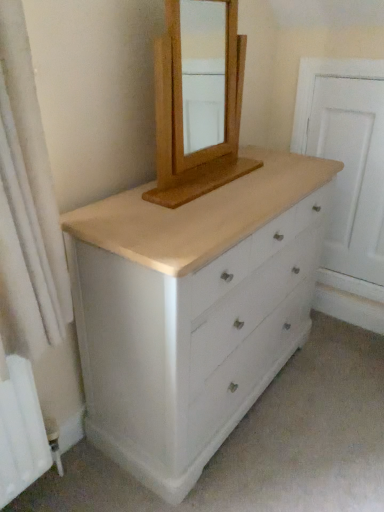
Where is `white wood screen door at right`? white wood screen door at right is located at coordinates (352, 170).

This screenshot has height=512, width=384. In order to click on natural wood mirror at upper center in this screenshot , I will do `click(198, 101)`.

Consider the image. Could you measure the distance between white painted wood chest of drawers at center and white wood screen door at right?

white painted wood chest of drawers at center and white wood screen door at right are 83.64 centimeters apart from each other.

Between white painted wood chest of drawers at center and white wood screen door at right, which one has more height?

white wood screen door at right.

How different are the orientations of white painted wood chest of drawers at center and white wood screen door at right in degrees?

The angle between the facing direction of white painted wood chest of drawers at center and the facing direction of white wood screen door at right is 90 degrees.

Which is less distant, (167,347) or (383,147)?

Point (167,347)

Which is behind, natural wood mirror at upper center or white fabric shower curtain at left?

natural wood mirror at upper center is further away from the camera.

Considering the positions of objects natural wood mirror at upper center and white fabric shower curtain at left in the image provided, who is more to the right, natural wood mirror at upper center or white fabric shower curtain at left?

From the viewer's perspective, natural wood mirror at upper center appears more on the right side.

From a real-world perspective, is natural wood mirror at upper center physically above white fabric shower curtain at left?

Yes, from a real-world perspective, natural wood mirror at upper center is over white fabric shower curtain at left

Does white fabric shower curtain at left have a larger size compared to natural wood mirror at upper center?

Correct, white fabric shower curtain at left is larger in size than natural wood mirror at upper center.

Is white fabric shower curtain at left not close to natural wood mirror at upper center?

That's right, there is a large distance between white fabric shower curtain at left and natural wood mirror at upper center.

Is white fabric shower curtain at left spatially inside natural wood mirror at upper center, or outside of it?

white fabric shower curtain at left lies outside natural wood mirror at upper center.

Is white fabric shower curtain at left looking in the opposite direction of white painted wood chest of drawers at center?

white fabric shower curtain at left is not turned away from white painted wood chest of drawers at center.

From a real-world perspective, is white fabric shower curtain at left over white painted wood chest of drawers at center?

Yes.

Can you confirm if white fabric shower curtain at left is shorter than white painted wood chest of drawers at center?

Indeed, white fabric shower curtain at left has a lesser height compared to white painted wood chest of drawers at center.

Considering the relative sizes of white fabric shower curtain at left and white painted wood chest of drawers at center in the image provided, is white fabric shower curtain at left bigger than white painted wood chest of drawers at center?

No.

The height and width of the screenshot is (512, 384). Find the location of `the chest of drawers lying below the white fabric shower curtain at left (from the image's perspective)`. the chest of drawers lying below the white fabric shower curtain at left (from the image's perspective) is located at coordinates (192, 311).

From the image's perspective, would you say white painted wood chest of drawers at center is shown under white fabric shower curtain at left?

Yes.

From a real-world perspective, is white painted wood chest of drawers at center physically located above or below white fabric shower curtain at left?

white painted wood chest of drawers at center is below white fabric shower curtain at left.

How distant is white painted wood chest of drawers at center from white fabric shower curtain at left?

A distance of 50.60 centimeters exists between white painted wood chest of drawers at center and white fabric shower curtain at left.

Considering the positions of objects white wood screen door at right and white painted wood chest of drawers at center in the image provided, who is behind, white wood screen door at right or white painted wood chest of drawers at center?

white wood screen door at right is further away from the camera.

Consider the image. Does white wood screen door at right touch white painted wood chest of drawers at center?

No, white wood screen door at right is not touching white painted wood chest of drawers at center.

Is white wood screen door at right inside the boundaries of white painted wood chest of drawers at center, or outside?

white wood screen door at right is not enclosed by white painted wood chest of drawers at center.

Between white painted wood chest of drawers at center and natural wood mirror at upper center, which one has smaller size?

Smaller between the two is natural wood mirror at upper center.

From a real-world perspective, is white painted wood chest of drawers at center over natural wood mirror at upper center?

No, from a real-world perspective, white painted wood chest of drawers at center is not on top of natural wood mirror at upper center.

Based on the photo, is white painted wood chest of drawers at center surrounding natural wood mirror at upper center?

No, white painted wood chest of drawers at center does not contain natural wood mirror at upper center.

Is point (253, 377) closer or farther from the camera than point (158, 204)?

Point (253, 377).

Locate an element on the screen. Image resolution: width=384 pixels, height=512 pixels. screen door on the right side of white painted wood chest of drawers at center is located at coordinates (352, 170).

Locate an element on the screen. Image resolution: width=384 pixels, height=512 pixels. shower curtain lying below the natural wood mirror at upper center (from the image's perspective) is located at coordinates (28, 223).

From the image, which object appears to be nearer to white fabric shower curtain at left, white painted wood chest of drawers at center or white wood screen door at right?

white painted wood chest of drawers at center lies closer to white fabric shower curtain at left than the other object.

From the image, which object appears to be nearer to white wood screen door at right, natural wood mirror at upper center or white fabric shower curtain at left?

natural wood mirror at upper center.

Which object lies further to the anchor point natural wood mirror at upper center, white painted wood chest of drawers at center or white wood screen door at right?

white painted wood chest of drawers at center lies further to natural wood mirror at upper center than the other object.

Looking at the image, which one is located further to white wood screen door at right, white painted wood chest of drawers at center or white fabric shower curtain at left?

white fabric shower curtain at left.

From the image, which object appears to be farther from white fabric shower curtain at left, white wood screen door at right or white painted wood chest of drawers at center?

The object further to white fabric shower curtain at left is white wood screen door at right.

Based on their spatial positions, is natural wood mirror at upper center or white wood screen door at right further from white fabric shower curtain at left?

The object further to white fabric shower curtain at left is white wood screen door at right.

Which object lies further to the anchor point white painted wood chest of drawers at center, natural wood mirror at upper center or white fabric shower curtain at left?

natural wood mirror at upper center lies further to white painted wood chest of drawers at center than the other object.

When comparing their distances from white painted wood chest of drawers at center, does white fabric shower curtain at left or natural wood mirror at upper center seem further?

The object further to white painted wood chest of drawers at center is natural wood mirror at upper center.

Where is `shower curtain between natural wood mirror at upper center and white painted wood chest of drawers at center from top to bottom`? The height and width of the screenshot is (512, 384). shower curtain between natural wood mirror at upper center and white painted wood chest of drawers at center from top to bottom is located at coordinates (28, 223).

Locate an element on the screen. The height and width of the screenshot is (512, 384). medicine cabinet between white fabric shower curtain at left and white wood screen door at right is located at coordinates (198, 101).

You are a GUI agent. You are given a task and a screenshot of the screen. Output one action in this format:
    pyautogui.click(x=<x>, y=<y>)
    Task: Click on the medicine cabinet between white painted wood chest of drawers at center and white wood screen door at right from front to back
    
    Given the screenshot: What is the action you would take?
    pyautogui.click(x=198, y=101)

Image resolution: width=384 pixels, height=512 pixels. I want to click on chest of drawers between white fabric shower curtain at left and white wood screen door at right, so click(x=192, y=311).